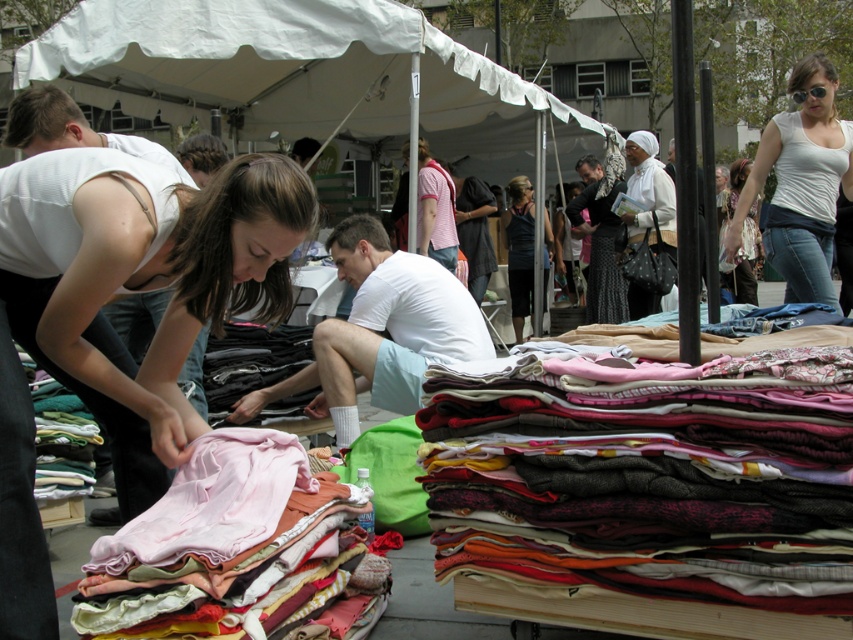
Measure the distance between striped cotton shirt at center and matte black shirt at center.

76.84 centimeters

Between striped cotton shirt at center and matte black shirt at center, which one is positioned higher?

striped cotton shirt at center is higher up.

Does point (448, 259) come closer to viewer compared to point (480, 209)?

Yes, point (448, 259) is in front of point (480, 209).

Where is `striped cotton shirt at center`? striped cotton shirt at center is located at coordinates (434, 209).

Looking at this image, who is more distant from viewer, [763,157] or [634,148]?

The point [634,148] is more distant.

Does white matte tank top at upper right have a lesser height compared to white matte scarf at upper center?

No, white matte tank top at upper right is not shorter than white matte scarf at upper center.

Locate an element on the screen. The height and width of the screenshot is (640, 853). white matte tank top at upper right is located at coordinates (801, 182).

What are the coordinates of `white matte tank top at upper right` in the screenshot? It's located at (801, 182).

Based on the photo, is white matte scarf at upper center closer to camera compared to matte black shirt at center?

Yes, it is in front of matte black shirt at center.

From the picture: Does white matte scarf at upper center appear under matte black shirt at center?

No, white matte scarf at upper center is not below matte black shirt at center.

What do you see at coordinates (650, 198) in the screenshot? This screenshot has height=640, width=853. I see `white matte scarf at upper center` at bounding box center [650, 198].

Locate an element on the screen. The width and height of the screenshot is (853, 640). white matte scarf at upper center is located at coordinates (650, 198).